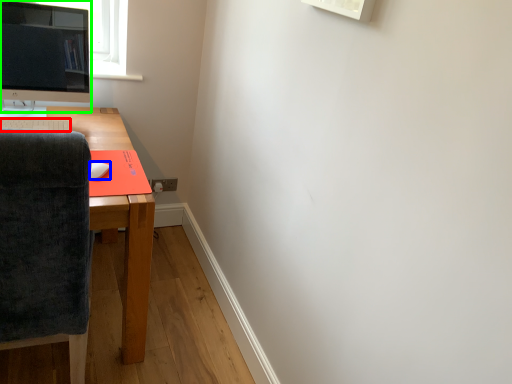
Question: Estimate the real-world distances between objects in this image. Which object is farther from desktop (highlighted by a red box), mouse (highlighted by a blue box) or computer monitor (highlighted by a green box)?

Choices:
 (A) mouse
 (B) computer monitor

Answer: (B)